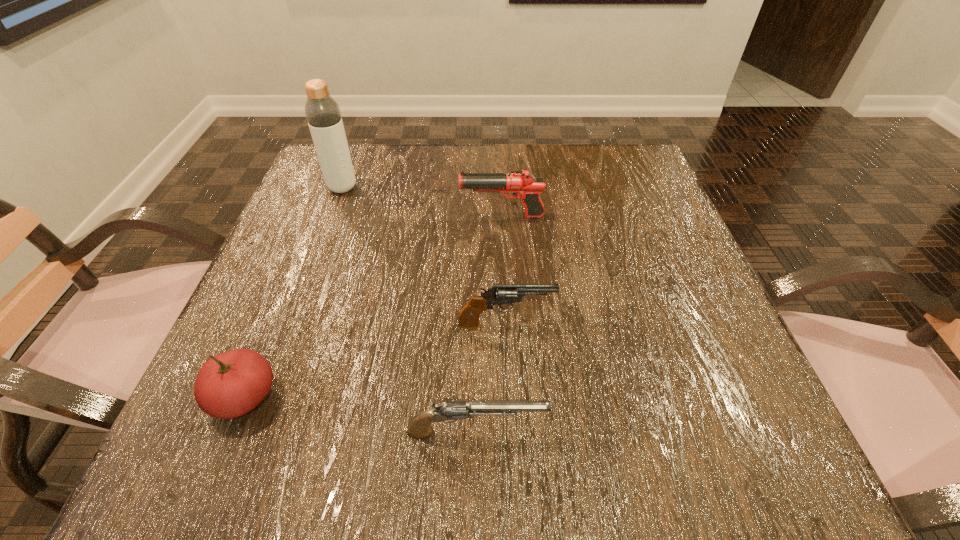
Find the location of `object at the near left corner`. object at the near left corner is located at coordinates (231, 384).

The width and height of the screenshot is (960, 540). Find the location of `free spot at the far edge of the desktop`. free spot at the far edge of the desktop is located at coordinates (513, 170).

Locate an element on the screen. The height and width of the screenshot is (540, 960). vacant area at the near edge of the desktop is located at coordinates (388, 478).

Locate an element on the screen. vacant space at the left edge is located at coordinates (300, 247).

This screenshot has height=540, width=960. In the image, there is a desktop. What are the coordinates of `vacant space at the right edge` in the screenshot? It's located at (715, 336).

In the image, there is a desktop. Where is `vacant space at the far left corner`? Image resolution: width=960 pixels, height=540 pixels. vacant space at the far left corner is located at coordinates point(314,177).

At what (x,y) coordinates should I click in order to perform the action: click on free area in between the tomato and the farthest object. Please return your answer as a coordinate pair (x, y). Looking at the image, I should click on (294, 293).

I want to click on unoccupied area between the tomato and the shortest gun, so click(361, 415).

Locate an element on the screen. This screenshot has height=540, width=960. empty space that is in between the second nearest gun and the farthest object is located at coordinates coord(423,256).

Where is `free space between the shortest object and the fourth nearest object`? free space between the shortest object and the fourth nearest object is located at coordinates (489, 324).